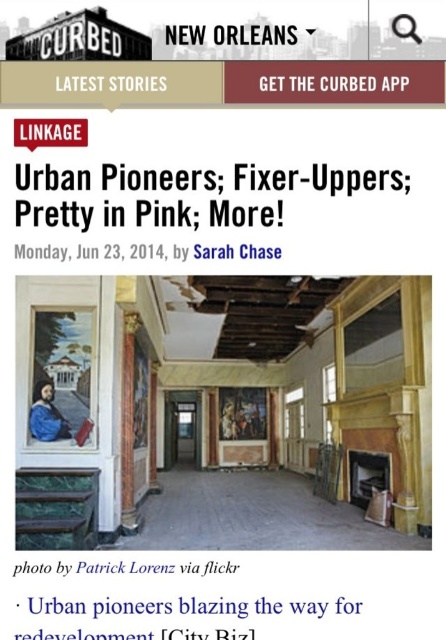
Based on the scene description, can you determine if the white paper at center has a greater width than the matte black text at upper center?

The white paper at center has a greater width than the matte black text at upper center according to the description.

You are a graphic designer working on a layout for a magazine spread. You have a white paper at center and matte black text at upper center. The editor wants to know if the spacing between them is sufficient for readability. The standard spacing requirement is at least 2 meters. Can the current layout meet this requirement?

The white paper at center and matte black text at upper center are 2.52 meters apart from each other, which exceeds the required 2 meters. Therefore, the current layout meets the spacing requirement for readability.